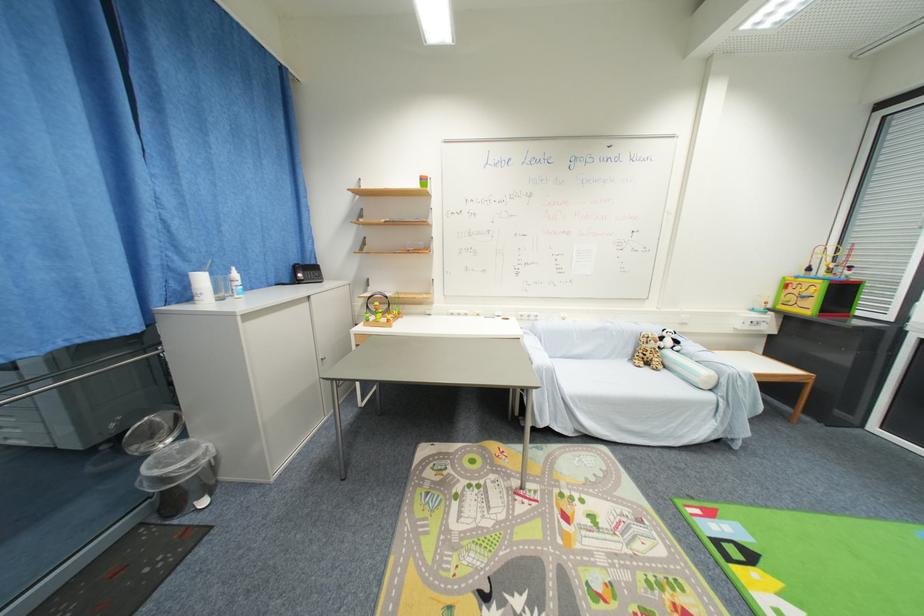
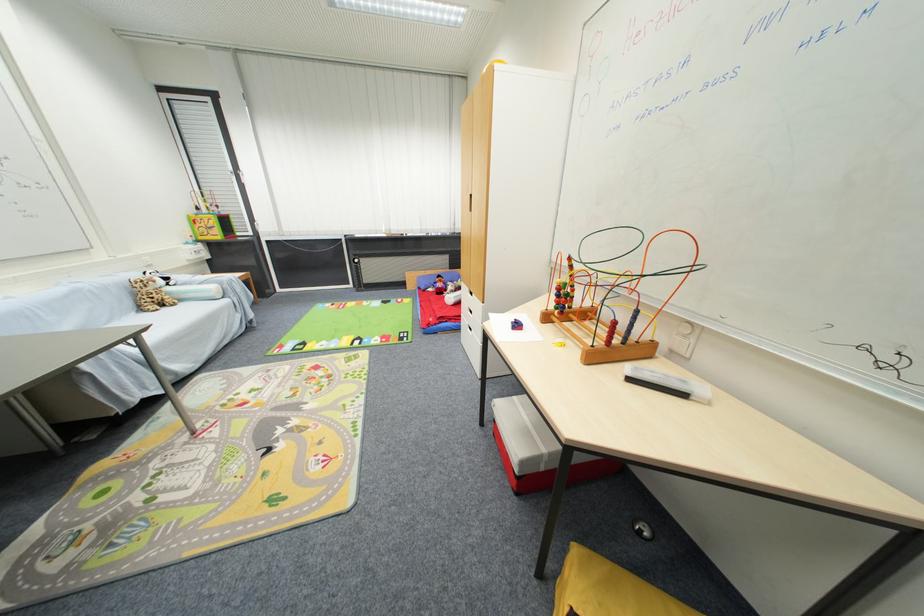
Where in the second image is the point corresponding to (x=651, y=371) from the first image?

(171, 310)